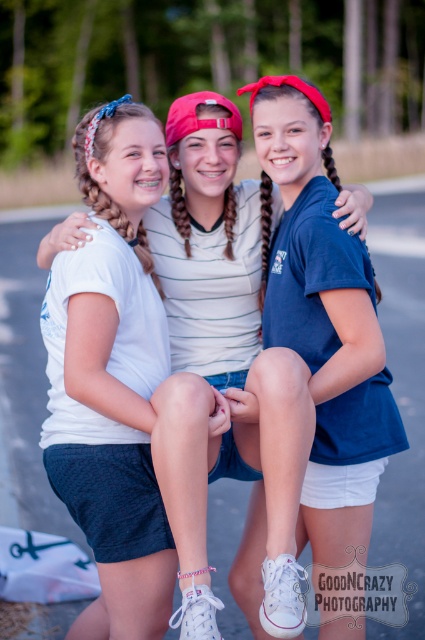
Question: Which of the following is the closest to the observer?

Choices:
 (A) (314, 216)
 (B) (261, 232)

Answer: (A)

Question: Is white matte t-shirt at center to the left of blue cotton shirt at center from the viewer's perspective?

Choices:
 (A) no
 (B) yes

Answer: (B)

Question: Which object is positioned farthest from the dark brown hair at center?

Choices:
 (A) white matte t-shirt at center
 (B) blue cotton shirt at center

Answer: (A)

Question: Can you confirm if white matte t-shirt at center is bigger than blue cotton shirt at center?

Choices:
 (A) yes
 (B) no

Answer: (A)

Question: Which is nearer to the dark brown hair at center?

Choices:
 (A) white matte t-shirt at center
 (B) blue cotton shirt at center

Answer: (B)

Question: Does white matte t-shirt at center appear under blue cotton shirt at center?

Choices:
 (A) no
 (B) yes

Answer: (B)